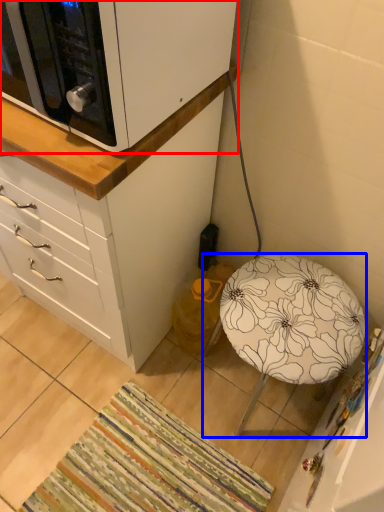
Question: Which object is further to the camera taking this photo, cabinetry (highlighted by a red box) or furniture (highlighted by a blue box)?

Choices:
 (A) cabinetry
 (B) furniture

Answer: (B)